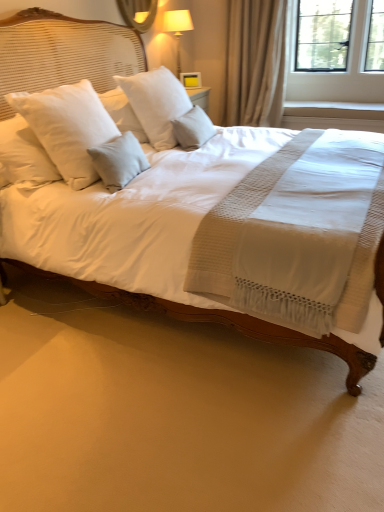
Question: Considering the positions of light gray fabric pillow at center, the 1th pillow viewed from the right, and white soft pillow at center, marked as the second pillow in a right-to-left arrangement, in the image, is light gray fabric pillow at center, the 1th pillow viewed from the right, bigger or smaller than white soft pillow at center, marked as the second pillow in a right-to-left arrangement,?

Choices:
 (A) big
 (B) small

Answer: (B)

Question: From the image's perspective, is light gray fabric pillow at center, the 1th pillow viewed from the right, above or below white soft pillow at center, marked as the second pillow in a right-to-left arrangement?

Choices:
 (A) below
 (B) above

Answer: (A)

Question: Estimate the real-world distances between objects in this image. Which object is farther from the white wood at upper right?

Choices:
 (A) white soft pillow at upper left, the 1th pillow positioned from the left
 (B) light gray fabric pillow at center, the 1th pillow viewed from the right
 (C) matte white lampshade at upper center
 (D) beige fabric curtain at upper right
 (E) white soft pillow at center, marked as the second pillow in a right-to-left arrangement

Answer: (A)

Question: Estimate the real-world distances between objects in this image. Which object is closer to the white soft pillow at upper left, arranged as the 3th pillow when viewed from the right?

Choices:
 (A) white soft pillow at center, which is the 2th pillow from left to right
 (B) white wood at upper right
 (C) matte white lampshade at upper center
 (D) glossy glass mirror at upper center
 (E) light gray fabric pillow at center, the 1th pillow viewed from the right

Answer: (A)